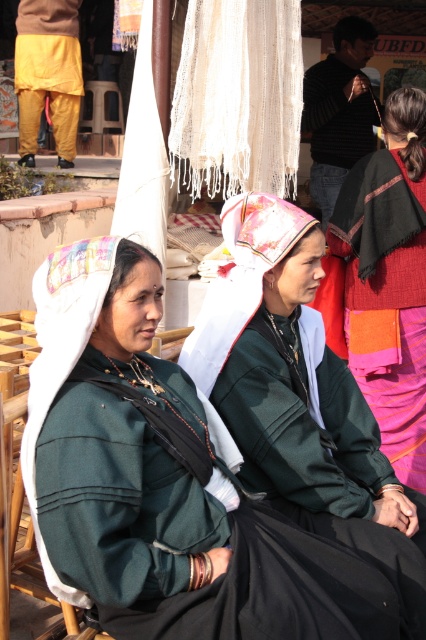
Question: Is white textured scarf at center to the right of black striped sweater at upper center from the viewer's perspective?

Choices:
 (A) yes
 (B) no

Answer: (B)

Question: Which point appears closest to the camera in this image?

Choices:
 (A) (316, 67)
 (B) (65, 164)

Answer: (A)

Question: Among these objects, which one is farthest from the camera?

Choices:
 (A) orange cotton sari at right
 (B) green fabric chair at lower left
 (C) green matte jacket at center
 (D) white woven cloth at upper center

Answer: (A)

Question: Estimate the real-world distances between objects in this image. Which object is closer to the orange cotton sari at right?

Choices:
 (A) black striped sweater at upper center
 (B) white woven cloth at upper center
 (C) yellow cotton pants at left

Answer: (B)

Question: Can you confirm if orange cotton sari at right is positioned above yellow cotton pants at left?

Choices:
 (A) yes
 (B) no

Answer: (B)

Question: Is orange cotton sari at right positioned before white textured scarf at center?

Choices:
 (A) yes
 (B) no

Answer: (B)